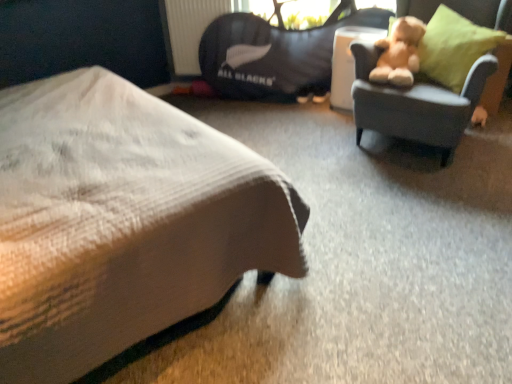
This screenshot has height=384, width=512. What do you see at coordinates (454, 47) in the screenshot? I see `green fabric pillow at right` at bounding box center [454, 47].

Describe the element at coordinates (416, 104) in the screenshot. The height and width of the screenshot is (384, 512). I see `soft gray fabric chair at upper right` at that location.

Where is `white textured bed at lower left`? white textured bed at lower left is located at coordinates click(122, 221).

Measure the distance from black fabric bean bag at upper center to white textured bed at lower left.

They are 5.73 feet apart.

From a real-world perspective, relative to white textured bed at lower left, is black fabric bean bag at upper center vertically above or below?

In terms of real-world spatial position, black fabric bean bag at upper center is below white textured bed at lower left.

Consider the image. Is black fabric bean bag at upper center bigger than white textured bed at lower left?

No.

Is white textured bed at lower left a part of black fabric bean bag at upper center?

No.

Locate an element on the screen. Image resolution: width=512 pixels, height=384 pixels. chair lying in front of the fluffy beige teddy bear at upper right is located at coordinates (416, 104).

Considering the relative positions of fluffy beige teddy bear at upper right and soft gray fabric chair at upper right in the image provided, is fluffy beige teddy bear at upper right to the left of soft gray fabric chair at upper right from the viewer's perspective?

Result: Indeed, fluffy beige teddy bear at upper right is positioned on the left side of soft gray fabric chair at upper right.

From the image's perspective, is fluffy beige teddy bear at upper right on soft gray fabric chair at upper right?

Yes, from the image's perspective, fluffy beige teddy bear at upper right is over soft gray fabric chair at upper right.

In terms of size, does green fabric pillow at right appear bigger or smaller than white textured bed at lower left?

Considering their sizes, green fabric pillow at right takes up less space than white textured bed at lower left.

Consider the image. From a real-world perspective, is green fabric pillow at right positioned over white textured bed at lower left based on gravity?

Actually, green fabric pillow at right is physically below white textured bed at lower left in the real world.

Does green fabric pillow at right lie in front of white textured bed at lower left?

No, the depth of green fabric pillow at right is greater than that of white textured bed at lower left.

Could you tell me if green fabric pillow at right is facing white textured bed at lower left?

Yes, green fabric pillow at right is turned towards white textured bed at lower left.

From the image's perspective, which one is positioned lower, black fabric bean bag at upper center or fluffy beige teddy bear at upper right?

fluffy beige teddy bear at upper right appears lower in the image.

Could you tell me if black fabric bean bag at upper center is turned towards fluffy beige teddy bear at upper right?

Yes, black fabric bean bag at upper center is turned towards fluffy beige teddy bear at upper right.

Which object is more forward, black fabric bean bag at upper center or fluffy beige teddy bear at upper right?

fluffy beige teddy bear at upper right is closer to the camera.

In order to click on bean bag chair that appears on the right of white textured bed at lower left in this screenshot , I will do `click(275, 54)`.

Measure the distance from white textured bed at lower left to black fabric bean bag at upper center.

A distance of 1.75 meters exists between white textured bed at lower left and black fabric bean bag at upper center.

In terms of height, does white textured bed at lower left look taller or shorter compared to black fabric bean bag at upper center?

In the image, white textured bed at lower left appears to be taller than black fabric bean bag at upper center.

From the image's perspective, who appears lower, white textured bed at lower left or black fabric bean bag at upper center?

From the image's view, white textured bed at lower left is below.

The image size is (512, 384). I want to click on bed in front of the green fabric pillow at right, so click(x=122, y=221).

Who is bigger, white textured bed at lower left or green fabric pillow at right?

white textured bed at lower left.

From the image's perspective, which is above, white textured bed at lower left or green fabric pillow at right?

green fabric pillow at right is shown above in the image.

Based on their positions, is white textured bed at lower left located to the left or right of green fabric pillow at right?

Clearly, white textured bed at lower left is on the left of green fabric pillow at right in the image.

In the image, is soft gray fabric chair at upper right on the left side or the right side of white textured bed at lower left?

soft gray fabric chair at upper right is positioned on white textured bed at lower left's right side.

From a real-world perspective, is soft gray fabric chair at upper right physically located above or below white textured bed at lower left?

Clearly, from a real-world perspective, soft gray fabric chair at upper right is below white textured bed at lower left.

Relative to white textured bed at lower left, is soft gray fabric chair at upper right in front or behind?

soft gray fabric chair at upper right is positioned farther from the viewer than white textured bed at lower left.

Can you confirm if soft gray fabric chair at upper right is bigger than white textured bed at lower left?

Actually, soft gray fabric chair at upper right might be smaller than white textured bed at lower left.

Locate an element on the screen. bed above the black fabric bean bag at upper center (from a real-world perspective) is located at coordinates (122, 221).

Find the location of `chair in front of the fluffy beige teddy bear at upper right`. chair in front of the fluffy beige teddy bear at upper right is located at coordinates (416, 104).

Considering their positions, is green fabric pillow at right positioned further to fluffy beige teddy bear at upper right than white textured bed at lower left?

white textured bed at lower left.

Which object lies nearer to the anchor point fluffy beige teddy bear at upper right, black fabric bean bag at upper center or green fabric pillow at right?

Among the two, green fabric pillow at right is located nearer to fluffy beige teddy bear at upper right.

From the picture: Considering their positions, is fluffy beige teddy bear at upper right positioned closer to soft gray fabric chair at upper right than black fabric bean bag at upper center?

fluffy beige teddy bear at upper right is positioned closer to the anchor soft gray fabric chair at upper right.

Based on their spatial positions, is fluffy beige teddy bear at upper right or white textured bed at lower left further from soft gray fabric chair at upper right?

white textured bed at lower left is positioned further to the anchor soft gray fabric chair at upper right.

Consider the image. Based on their spatial positions, is black fabric bean bag at upper center or fluffy beige teddy bear at upper right further from white textured bed at lower left?

Among the two, black fabric bean bag at upper center is located further to white textured bed at lower left.

Which object lies nearer to the anchor point black fabric bean bag at upper center, fluffy beige teddy bear at upper right or green fabric pillow at right?

fluffy beige teddy bear at upper right.

Estimate the real-world distances between objects in this image. Which object is further from green fabric pillow at right, black fabric bean bag at upper center or white textured bed at lower left?

Among the two, white textured bed at lower left is located further to green fabric pillow at right.

Looking at the image, which one is located closer to fluffy beige teddy bear at upper right, white textured bed at lower left or soft gray fabric chair at upper right?

Based on the image, soft gray fabric chair at upper right appears to be nearer to fluffy beige teddy bear at upper right.

The width and height of the screenshot is (512, 384). I want to click on teddy bear between white textured bed at lower left and soft gray fabric chair at upper right, so click(x=399, y=53).

Image resolution: width=512 pixels, height=384 pixels. Find the location of `chair situated between white textured bed at lower left and green fabric pillow at right from left to right`. chair situated between white textured bed at lower left and green fabric pillow at right from left to right is located at coordinates (416, 104).

The height and width of the screenshot is (384, 512). In order to click on chair between white textured bed at lower left and black fabric bean bag at upper center from front to back in this screenshot , I will do pyautogui.click(x=416, y=104).

Identify the location of throw pillow between white textured bed at lower left and black fabric bean bag at upper center in the front-back direction. (454, 47).